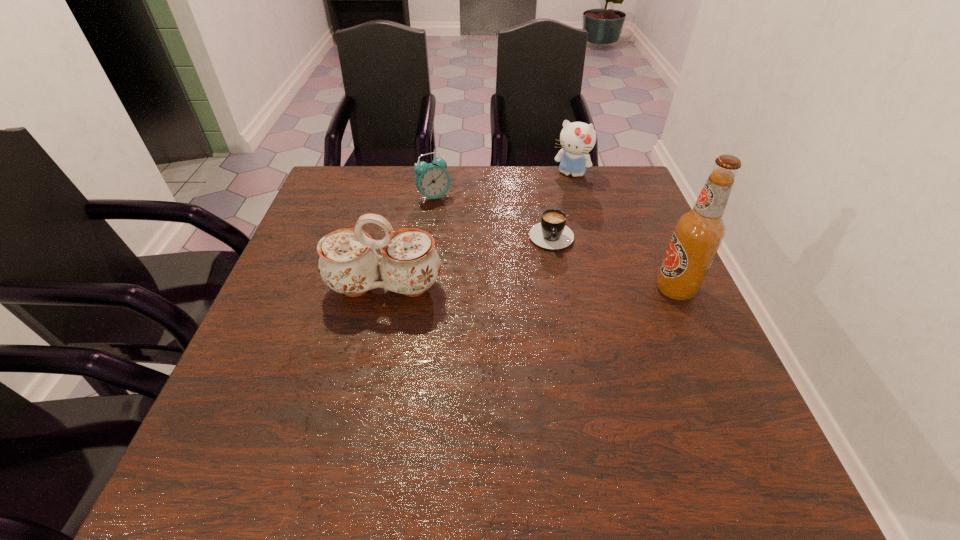
What are the coordinates of `alarm clock present at the far edge` in the screenshot? It's located at (432, 180).

You are a GUI agent. You are given a task and a screenshot of the screen. Output one action in this format:
    pyautogui.click(x=<x>, y=<y>)
    Task: Click on the object that is at the left edge
    The height and width of the screenshot is (540, 960).
    Given the screenshot: What is the action you would take?
    pyautogui.click(x=348, y=264)

Where is `beer bottle located at the right edge`? Image resolution: width=960 pixels, height=540 pixels. beer bottle located at the right edge is located at coordinates (698, 233).

The image size is (960, 540). In order to click on kitten located in the right edge section of the desktop in this screenshot , I will do `click(577, 139)`.

The height and width of the screenshot is (540, 960). Identify the location of object located at the far right corner. (577, 139).

Locate an element on the screen. free space at the far edge of the desktop is located at coordinates (472, 203).

In the image, there is a desktop. Identify the location of vacant space at the near edge. The width and height of the screenshot is (960, 540). (324, 397).

The image size is (960, 540). Identify the location of vacant region at the left edge. (302, 264).

In the image, there is a desktop. Identify the location of vacant space at the right edge. This screenshot has height=540, width=960. (613, 252).

The height and width of the screenshot is (540, 960). Find the location of `free space at the near left corner of the desktop`. free space at the near left corner of the desktop is located at coordinates (238, 408).